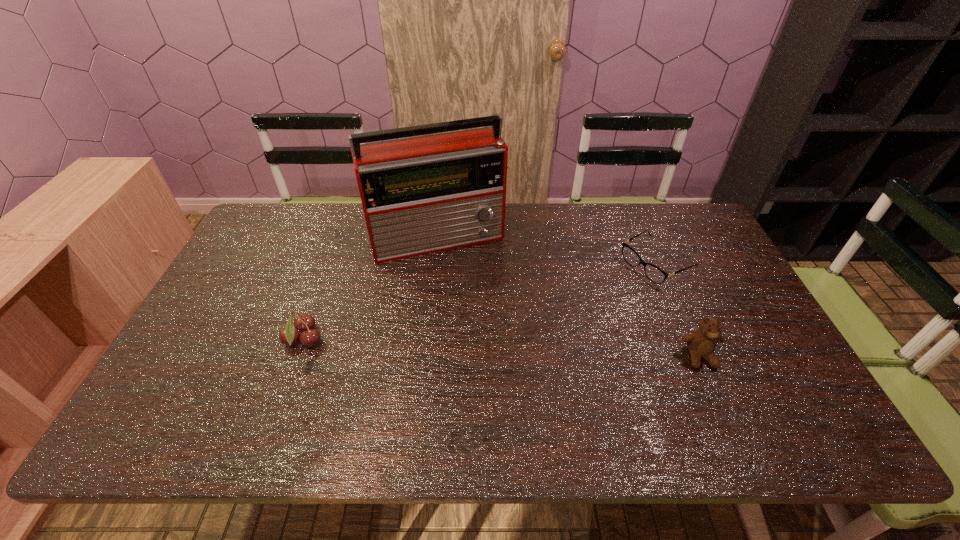
This screenshot has width=960, height=540. What are the coordinates of `vacant point located between the second tallest object and the cherry` in the screenshot? It's located at (502, 348).

I want to click on vacant space that's between the cherry and the spectacles, so click(480, 302).

At what (x,y) coordinates should I click in order to perform the action: click on unoccupied position between the spectacles and the third shortest object. Please return your answer as a coordinate pair (x, y). The height and width of the screenshot is (540, 960). Looking at the image, I should click on (678, 310).

Image resolution: width=960 pixels, height=540 pixels. Identify the location of vacant space that is in between the second tallest object and the spectacles. (678, 310).

Where is `blank region between the teddy bear and the second shortest object`? The image size is (960, 540). blank region between the teddy bear and the second shortest object is located at coordinates (502, 348).

Select which object is the closest to the tallest object. Please provide its 2D coordinates. Your answer should be formatted as a tuple, i.e. [(x, y)], where the tuple contains the x and y coordinates of a point satisfying the conditions above.

[(304, 323)]

Select which object appears as the second closest to the second shortest object. Please provide its 2D coordinates. Your answer should be formatted as a tuple, i.e. [(x, y)], where the tuple contains the x and y coordinates of a point satisfying the conditions above.

[(655, 274)]

Identify the location of free point that satisfies the following two spatial constraints: 1. on the front side of the spectacles; 2. on the left side of the radio receiver. The height and width of the screenshot is (540, 960). (436, 264).